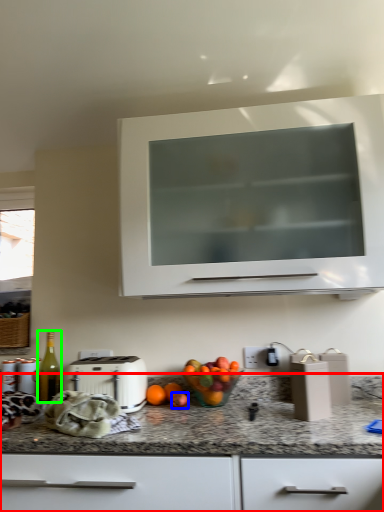
Question: Which object is positioned closest to countertop (highlighted by a red box)? Select from apple (highlighted by a blue box) and bottle (highlighted by a green box).

Choices:
 (A) apple
 (B) bottle

Answer: (A)